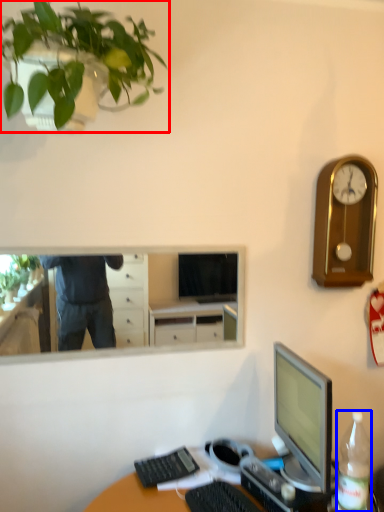
Question: Which of the following is the closest to the observer, houseplant (highlighted by a red box) or bottle (highlighted by a blue box)?

Choices:
 (A) houseplant
 (B) bottle

Answer: (A)